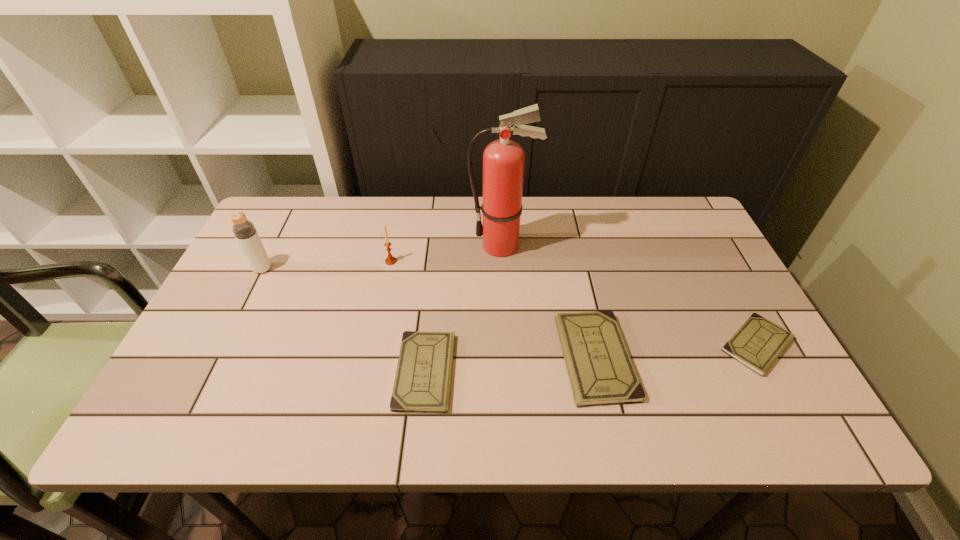
Where is `object present at the far edge`? This screenshot has height=540, width=960. object present at the far edge is located at coordinates (503, 160).

Locate an element on the screen. Image resolution: width=960 pixels, height=540 pixels. object that is positioned at the left edge is located at coordinates (244, 230).

What are the coordinates of `object that is positioned at the right edge` in the screenshot? It's located at (758, 343).

Find the location of a particular element. The image size is (960, 540). object that is positioned at the near right corner is located at coordinates (758, 343).

Where is `free space at the far edge of the desktop`? free space at the far edge of the desktop is located at coordinates (463, 204).

I want to click on free spot at the near edge of the desktop, so click(350, 362).

In order to click on free region at the left edge of the desktop in this screenshot , I will do `click(279, 282)`.

Find the location of `vacant space at the right edge`. vacant space at the right edge is located at coordinates (724, 310).

Where is `vacant space at the far left corner of the desktop`? vacant space at the far left corner of the desktop is located at coordinates (304, 211).

In the image, there is a desktop. Where is `blank space at the far right corner`? This screenshot has width=960, height=540. blank space at the far right corner is located at coordinates (666, 205).